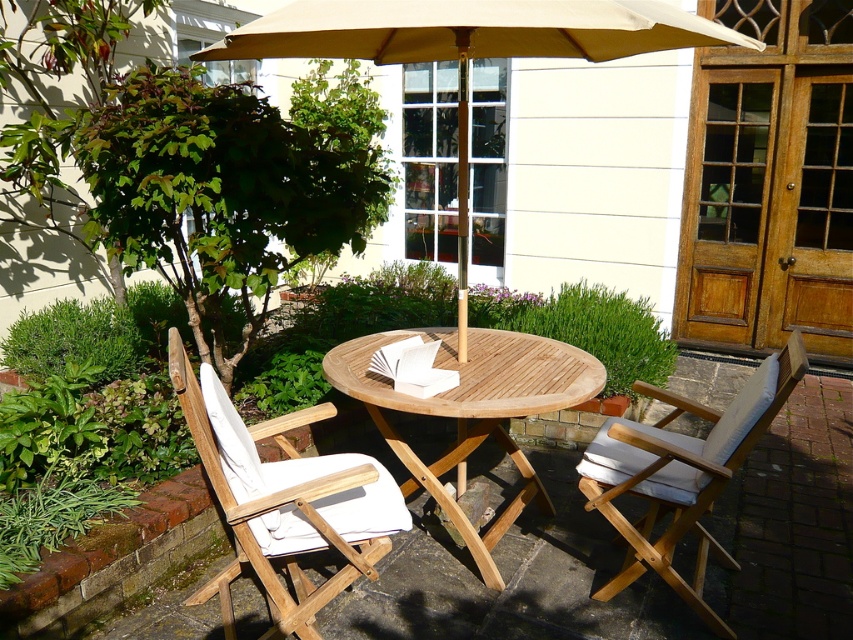
You are standing on the patio and want to place a small potted plant exactly at the point marked by the coordinates point (469, 49). Is this location under the shade of the beige fabric umbrella at center?

The point (469, 49) is where the beige fabric umbrella at center is located, so placing the potted plant there would place it directly under the shade of the beige fabric umbrella at center.

You are a person who is 1.7 meters tall. You want to sit at the teak wood table at center using the white wood chair at right. Based on the scene description, will your feet touch the ground when sitting?

The teak wood table at center is not as tall as white wood chair at right, meaning the chair is taller. Since the chair is taller than the table, your feet may not touch the ground when sitting because the chair is elevated compared to the table height.

You are standing at the center of the patio and want to place a small potted plant between the two points marked as point (256, 477) and point (666, 572). Which point should the plant be closer to in order to be positioned in front of the other point?

The plant should be closer to point (256, 477) because it is in front of point (666, 572).